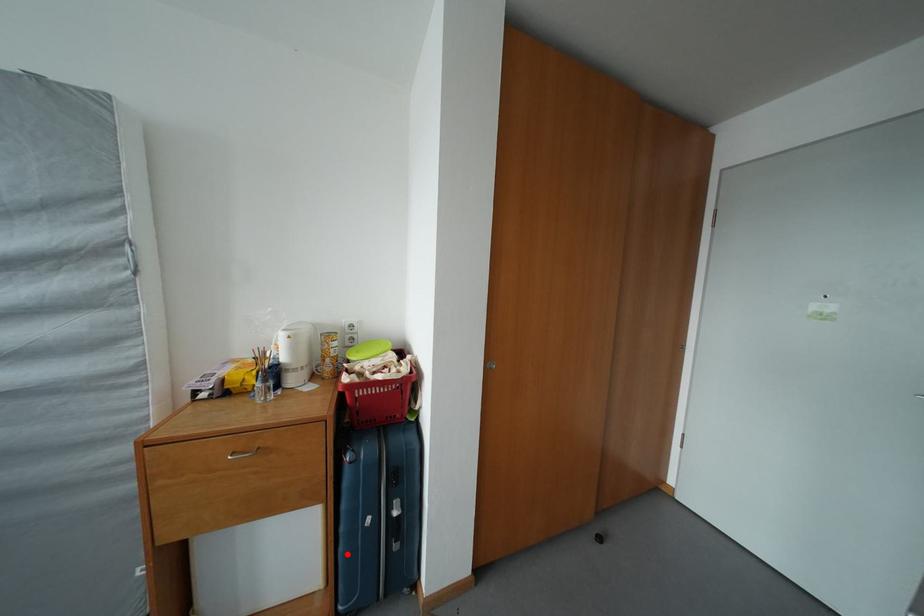
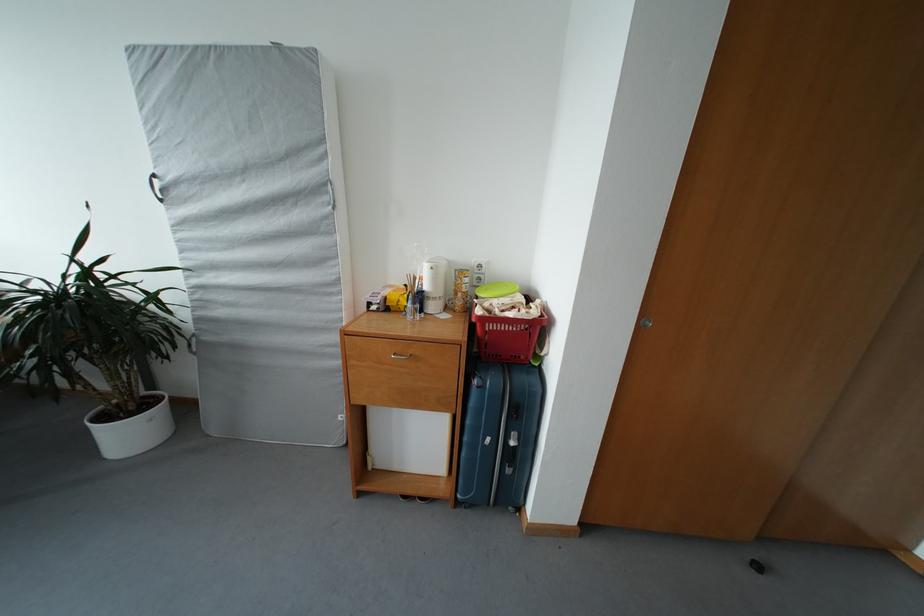
Question: A red point is marked in image1. In image2, is the corresponding 3D point closer to the camera or farther? Reply with the corresponding letter.

Choices:
 (A) The corresponding 3D point is closer.
 (B) The corresponding 3D point is farther.

Answer: (B)